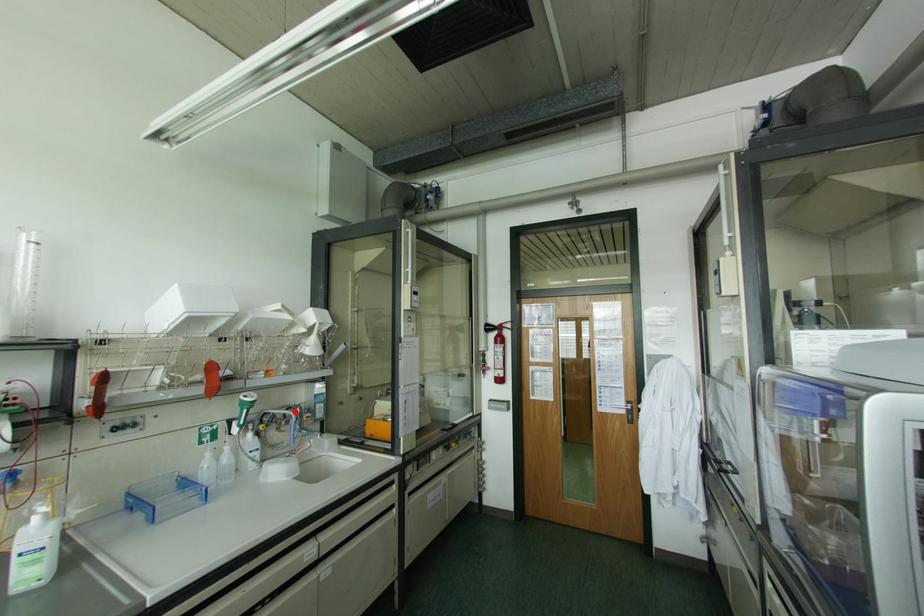
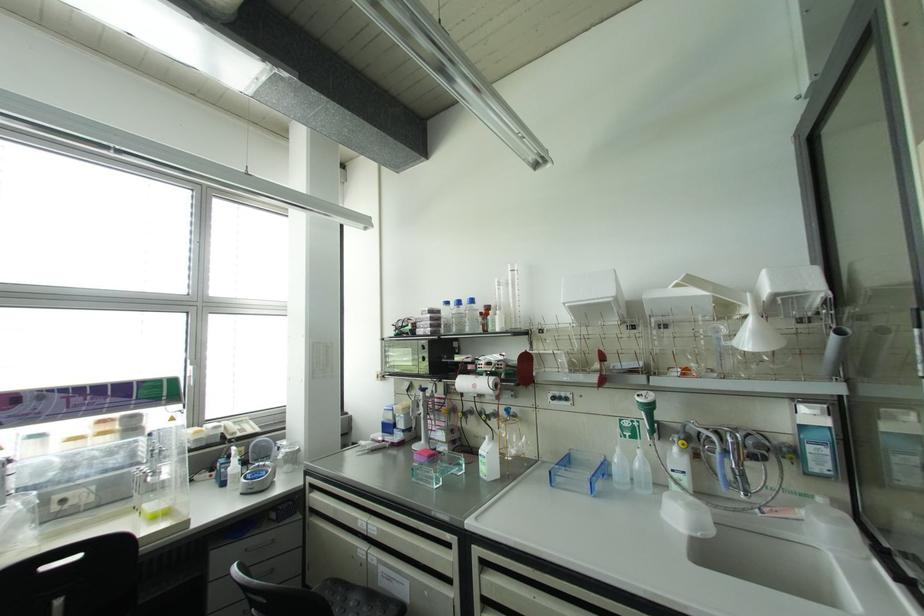
Where in the second image is the point corresponding to the highlighted location from the first image?

(723, 440)